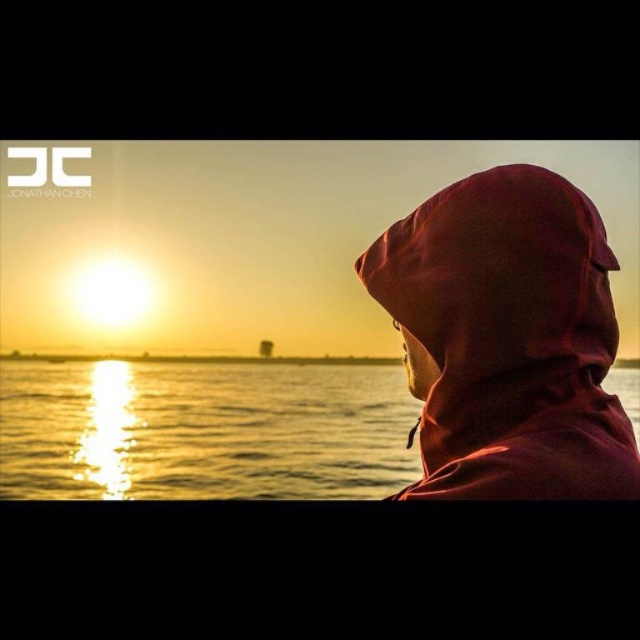
How distant is matte red hoodie at upper right from shiny metallic water at center?

matte red hoodie at upper right is 15.70 feet from shiny metallic water at center.

Based on the photo, who is positioned more to the left, matte red hoodie at upper right or shiny metallic water at center?

matte red hoodie at upper right is more to the left.

Which is in front, point (483, 497) or point (324, 461)?

Positioned in front is point (483, 497).

Locate an element on the screen. The width and height of the screenshot is (640, 640). matte red hoodie at upper right is located at coordinates (509, 339).